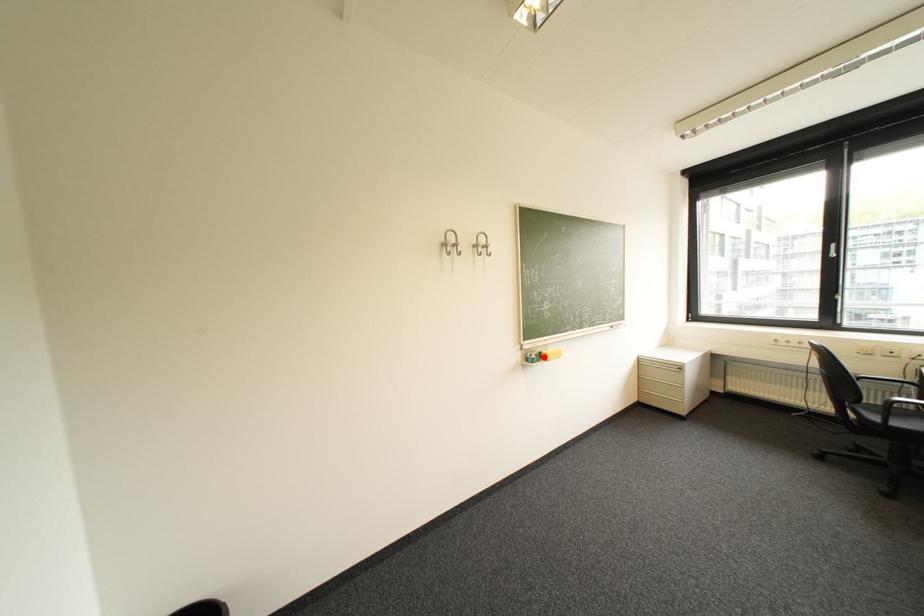
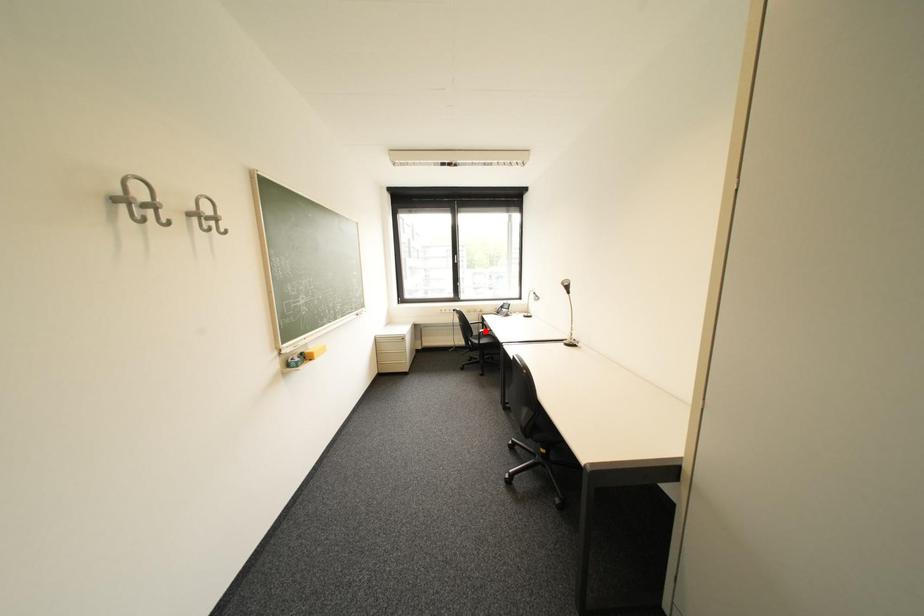
I am providing you with two images of the same scene from different viewpoints. A red point is marked on the first image and another point is marked on the second image. Does the point marked in image1 correspond to the same location as the one in image2?

No